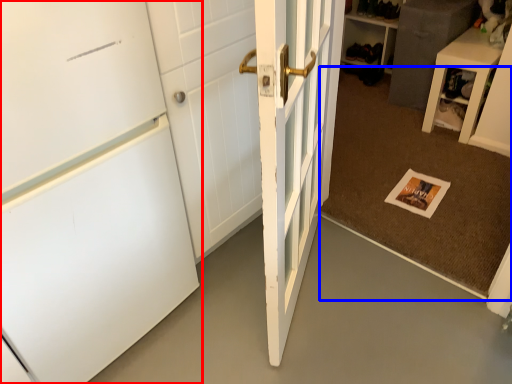
Question: Which object appears farthest to the camera in this image, door (highlighted by a red box) or doormat (highlighted by a blue box)?

Choices:
 (A) door
 (B) doormat

Answer: (B)